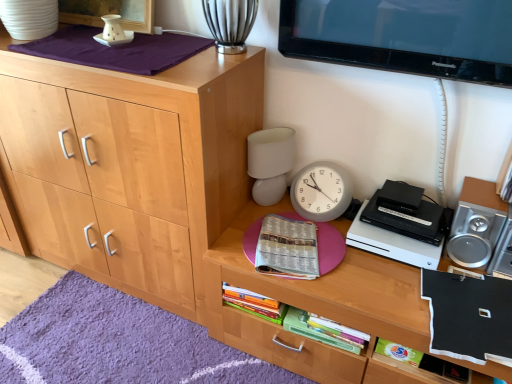
You are a GUI agent. You are given a task and a screenshot of the screen. Output one action in this format:
    pyautogui.click(x=<x>, y=<y>)
    Task: Click on the free space in front of black plastic dvd player at right
    The height and width of the screenshot is (384, 512).
    Given the screenshot: What is the action you would take?
    pyautogui.click(x=383, y=286)